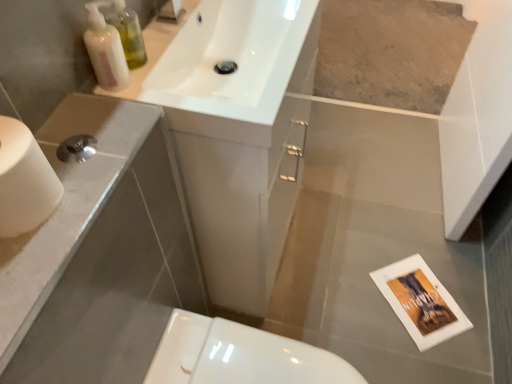
Image resolution: width=512 pixels, height=384 pixels. Find the location of `empty space that is ontop of white glossy toilet at lower center (from a real-world perspective)`. empty space that is ontop of white glossy toilet at lower center (from a real-world perspective) is located at coordinates (252, 359).